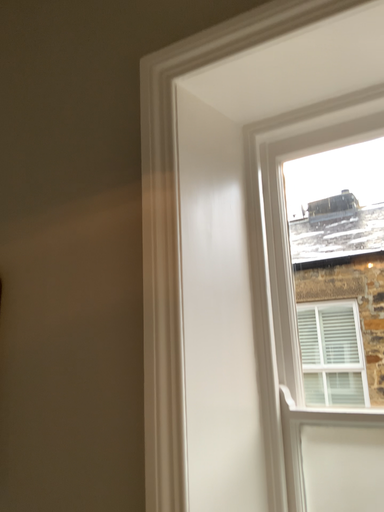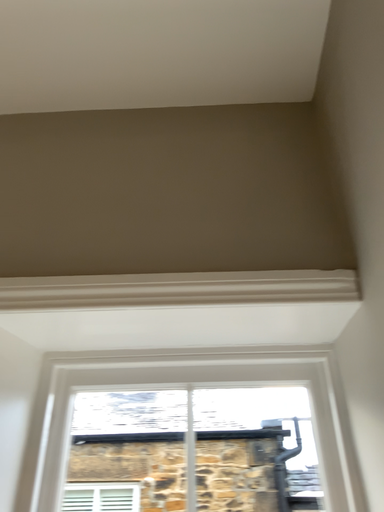
Question: Which way did the camera rotate in the video?

Choices:
 (A) rotated downward
 (B) rotated upward

Answer: (B)